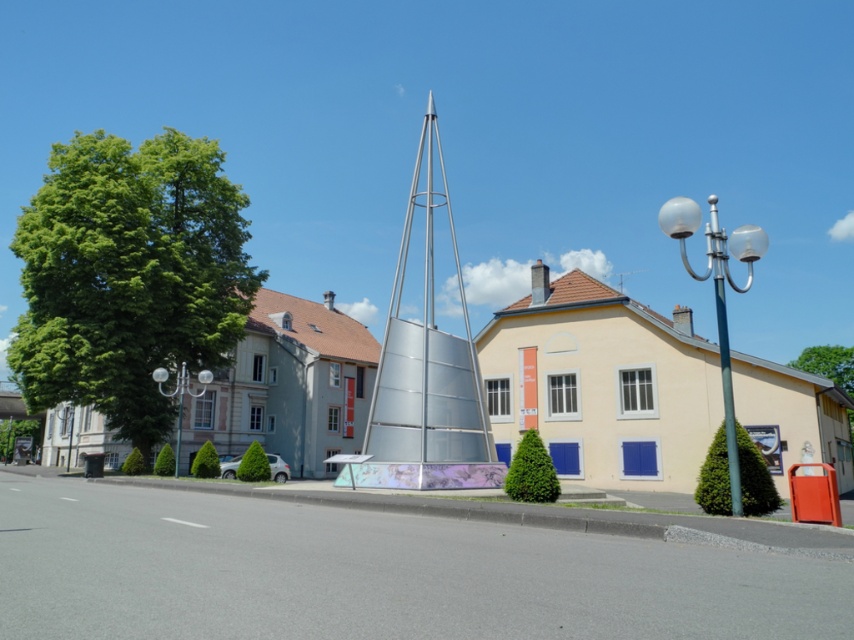
You are a city planner reviewing the layout of this street scene. You need to determine if the white glass lamp post at left will block the view of the green leafy tree at lower left from the main walkway. Based on their positions, what do you conclude?

The white glass lamp post at left is positioned over the green leafy tree at lower left, so it would block the view of the tree from the main walkway.

You are a city planner assessing the street scene. You need to determine if the metallic silver spire at center and the green leafy tree at lower left can both be seen from a nearby park located to the east. Considering their sizes, which one is more likely to block the view of the other?

The metallic silver spire at center is bigger than the green leafy tree at lower left, so it is more likely to block the view of the green leafy tree at lower left.